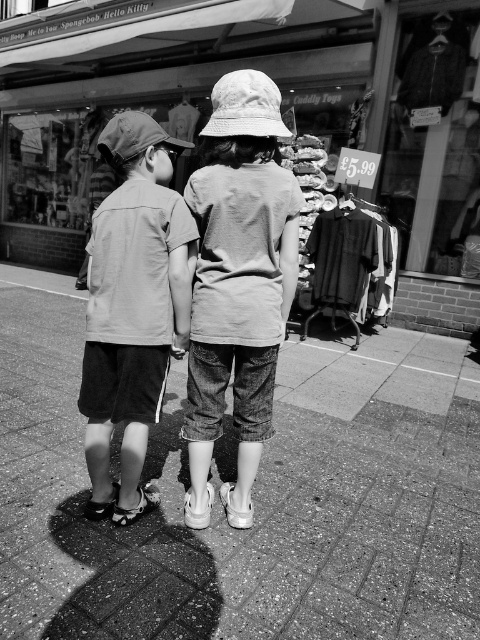
You are standing on the smooth concrete pavement at center. If you want to walk towards the Spongebob Hello Kitty shop sign, which direction should you face?

Since the smooth concrete pavement at center is located at point (253, 497), you should face towards the shop sign above the window to walk towards it.

You are a delivery person trying to place a package on the ground between the smooth concrete pavement at center and the textured fabric shirts at center. Can you place it there without it falling through?

The smooth concrete pavement at center is not as tall as textured fabric shirts at center, so the package can be placed between them without falling through since the pavement is lower than the shirts.

You are a delivery person who needs to place a denim jacket at center onto the smooth concrete pavement at center. The minimum distance required to safely place the jacket is 5 meters. Can you safely place the jacket from your current position?

The smooth concrete pavement at center is 4.94 meters from denim jacket at center. Since the required distance is 5 meters, you cannot safely place the jacket as the distance is slightly less than required.